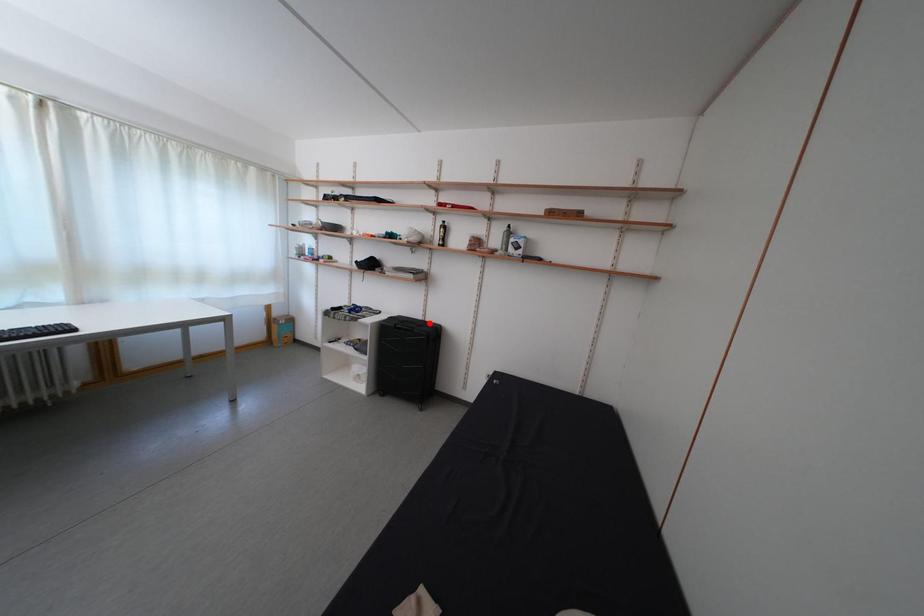
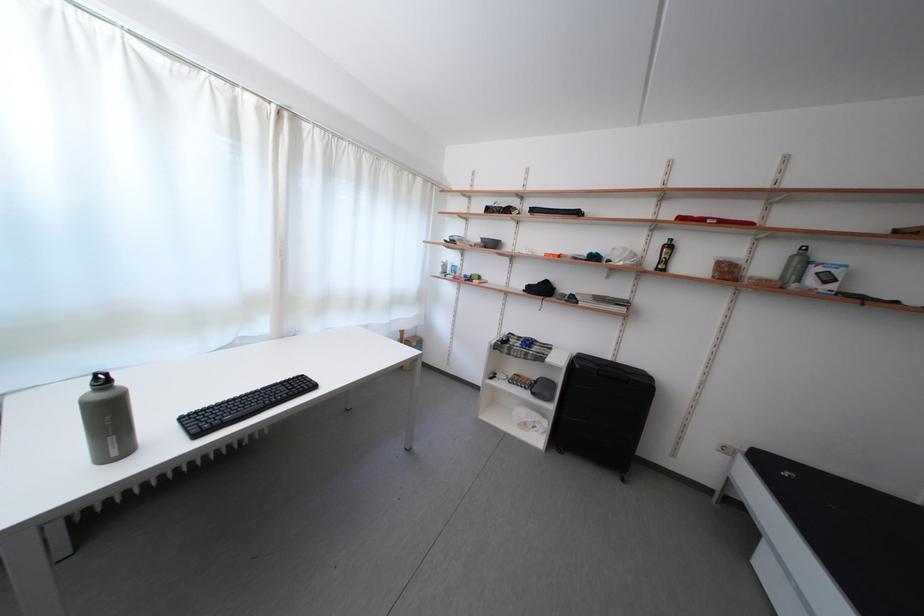
In the second image, find the point that corresponds to the highlighted location in the first image.

(617, 363)